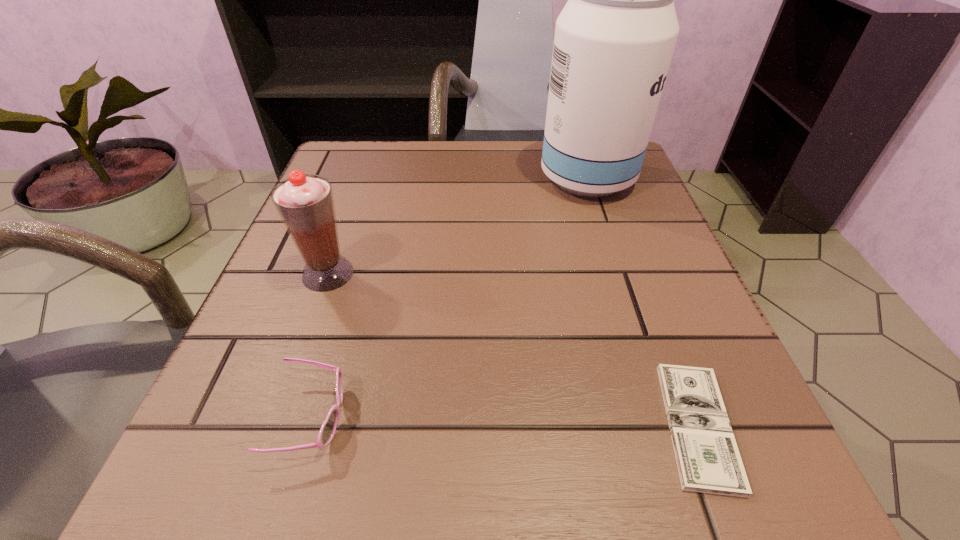
The height and width of the screenshot is (540, 960). Identify the location of vacant space at the far edge. (404, 184).

Image resolution: width=960 pixels, height=540 pixels. I want to click on vacant space at the left edge of the desktop, so click(300, 384).

Where is `vacant point at the right edge`? The image size is (960, 540). vacant point at the right edge is located at coordinates (590, 278).

Where is `free region at the far left corner of the desktop`? Image resolution: width=960 pixels, height=540 pixels. free region at the far left corner of the desktop is located at coordinates (349, 146).

At what (x,y) coordinates should I click in order to perform the action: click on free space at the near left corner of the desktop. Please return your answer as a coordinate pair (x, y). Image resolution: width=960 pixels, height=540 pixels. Looking at the image, I should click on (285, 468).

Find the location of `empty space between the alcohol and the second farthest object`. empty space between the alcohol and the second farthest object is located at coordinates (458, 226).

Identify the location of free spot between the sunglasses and the farthest object. (449, 299).

This screenshot has width=960, height=540. In order to click on vacant area that lies between the smoothie and the tallest object in this screenshot , I will do `click(458, 226)`.

The height and width of the screenshot is (540, 960). I want to click on free space that is in between the tallest object and the third nearest object, so click(458, 226).

The width and height of the screenshot is (960, 540). What are the coordinates of `free space between the sunglasses and the dollar` in the screenshot? It's located at (505, 422).